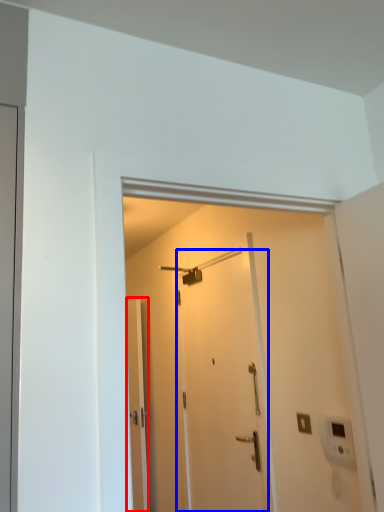
Question: Which object appears closest to the camera in this image, door (highlighted by a red box) or door (highlighted by a blue box)?

Choices:
 (A) door
 (B) door

Answer: (B)